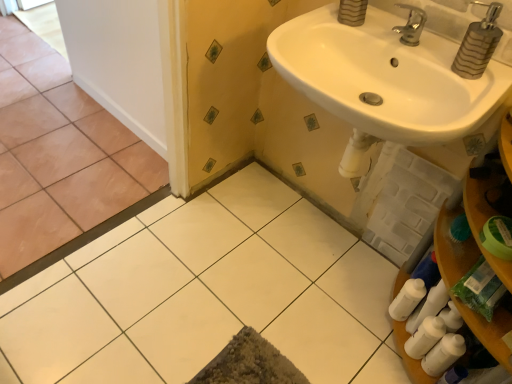
What are the coordinates of `vacant area that is in front of metallic striped soap dispenser at upper right` in the screenshot? It's located at (474, 100).